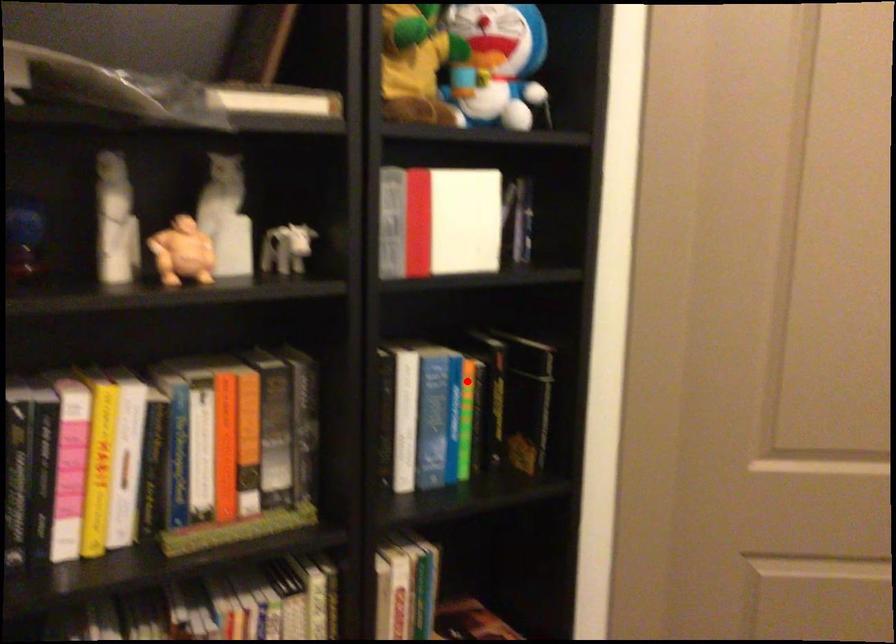
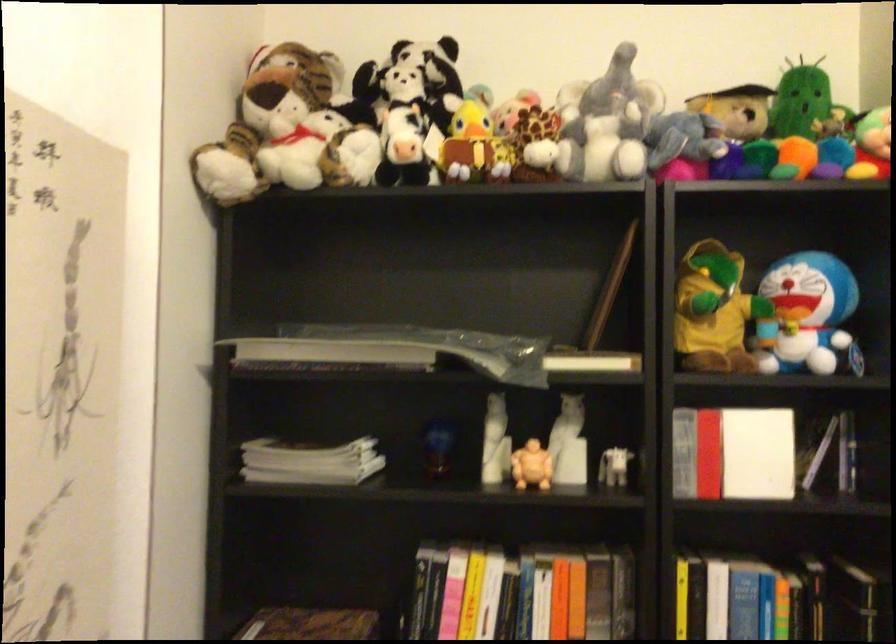
The point at the highlighted location is marked in the first image. Where is the corresponding point in the second image?

(780, 599)